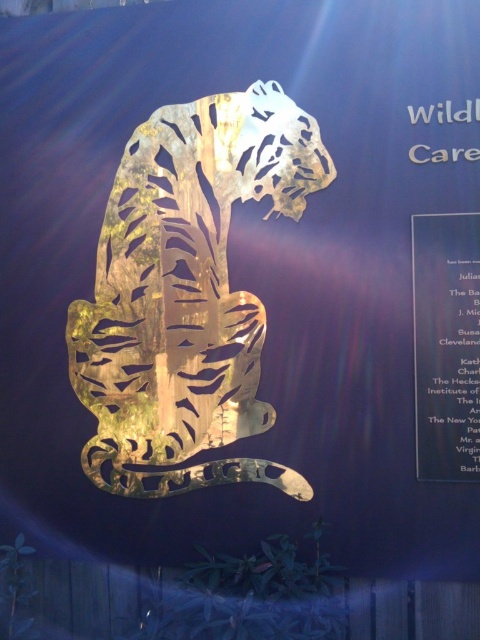
Question: Is gold reflective tiger at center below metallic gold plaque at right?

Choices:
 (A) no
 (B) yes

Answer: (A)

Question: Is gold reflective tiger at center behind metallic gold plaque at right?

Choices:
 (A) no
 (B) yes

Answer: (B)

Question: Does gold reflective tiger at center appear under metallic gold plaque at right?

Choices:
 (A) no
 (B) yes

Answer: (A)

Question: Among these points, which one is farthest from the camera?

Choices:
 (A) (168, 241)
 (B) (444, 236)

Answer: (A)